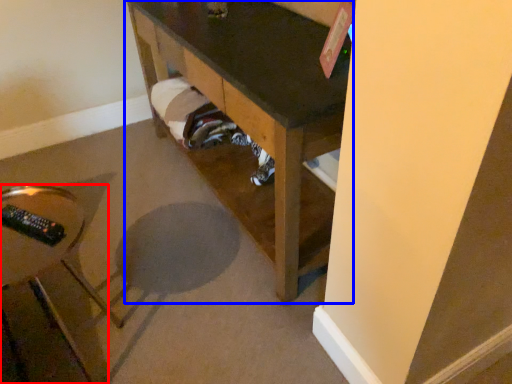
Question: Which point is closer to the camera, furniture (highlighted by a red box) or furniture (highlighted by a blue box)?

Choices:
 (A) furniture
 (B) furniture

Answer: (A)